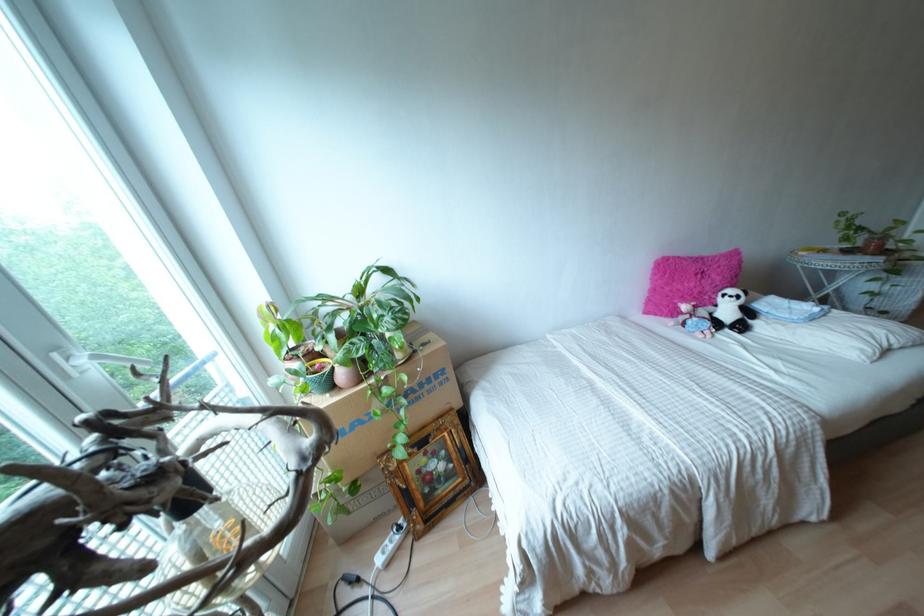
Which object does [432,472] point to?

It corresponds to the gold picture frame in the image.